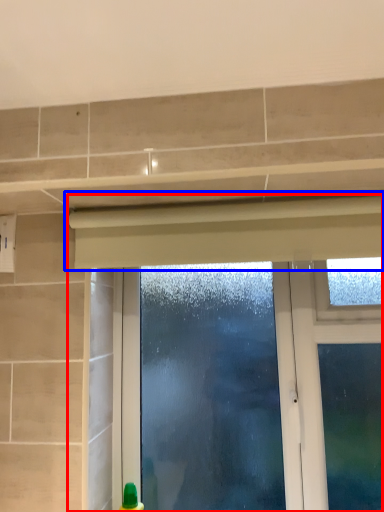
Question: Which object appears farthest to the camera in this image, window (highlighted by a red box) or curtain (highlighted by a blue box)?

Choices:
 (A) window
 (B) curtain

Answer: (A)